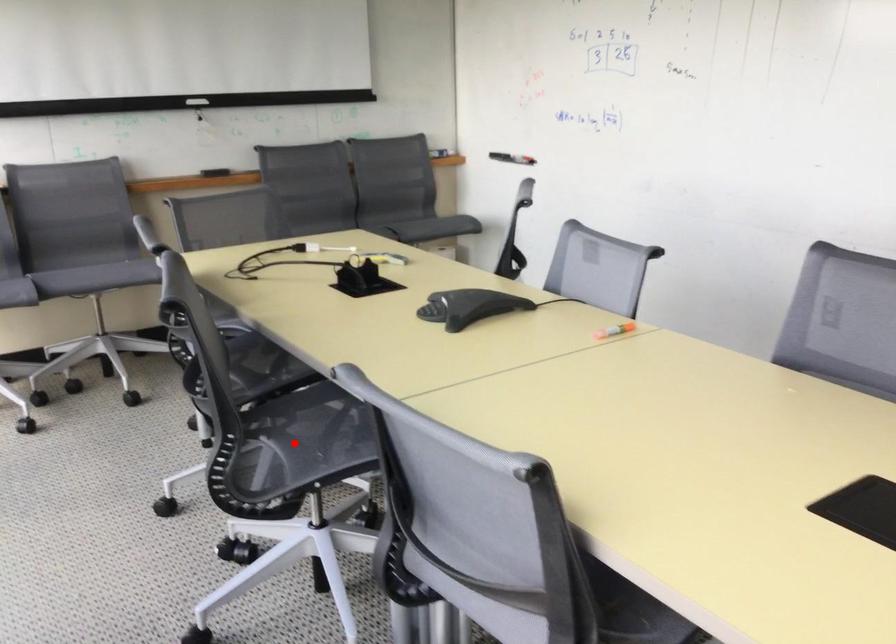
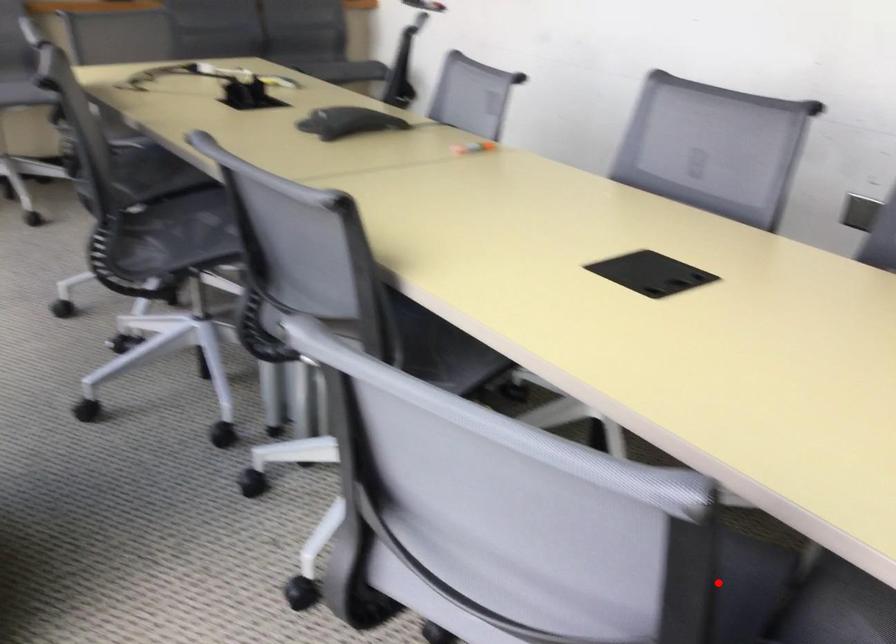
I am providing you with two images of the same scene from different viewpoints. A red point is marked on the first image and another point is marked on the second image. Do the highlighted points in image1 and image2 indicate the same real-world spot?

No